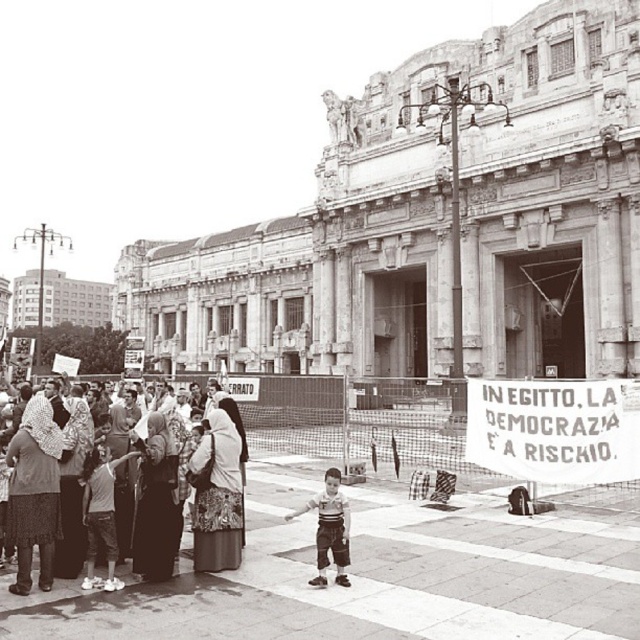
Question: Is matte fabric crowd at center left wider than light brown pants at center?

Choices:
 (A) yes
 (B) no

Answer: (B)

Question: Is matte fabric crowd at center left further to camera compared to light brown pants at center?

Choices:
 (A) no
 (B) yes

Answer: (B)

Question: Which point is closer to the camera?

Choices:
 (A) (x=333, y=500)
 (B) (x=28, y=435)

Answer: (B)

Question: Which point is closer to the camera?

Choices:
 (A) matte fabric crowd at center left
 (B) light brown pants at center

Answer: (B)

Question: Can you confirm if matte fabric crowd at center left is positioned to the left of light brown pants at center?

Choices:
 (A) yes
 (B) no

Answer: (A)

Question: Which of the following is the closest to the observer?

Choices:
 (A) (120, 464)
 (B) (348, 509)

Answer: (B)